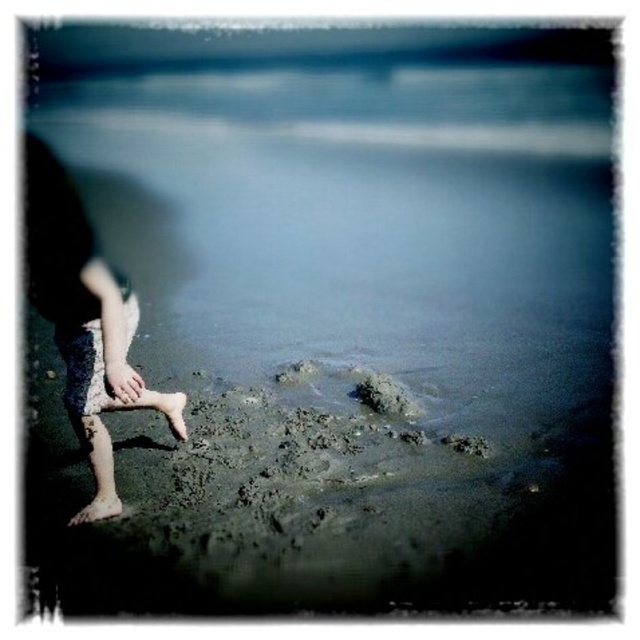
Question: Which point is closer to the camera?

Choices:
 (A) brown sand at lower left
 (B) dark skin legs at left
 (C) barefoot sand at lower left

Answer: (B)

Question: Which object is farther from the camera taking this photo?

Choices:
 (A) barefoot sand at lower left
 (B) brown sand at lower left

Answer: (A)

Question: Observing the image, what is the correct spatial positioning of barefoot sand at lower left in reference to brown sand at lower left?

Choices:
 (A) left
 (B) right

Answer: (B)

Question: From the image, what is the correct spatial relationship of dark skin legs at left in relation to barefoot sand at lower left?

Choices:
 (A) above
 (B) below

Answer: (A)

Question: Can you confirm if dark skin legs at left is positioned below barefoot sand at lower left?

Choices:
 (A) no
 (B) yes

Answer: (A)

Question: Which point is farther to the camera?

Choices:
 (A) brown sand at lower left
 (B) dark skin legs at left

Answer: (A)